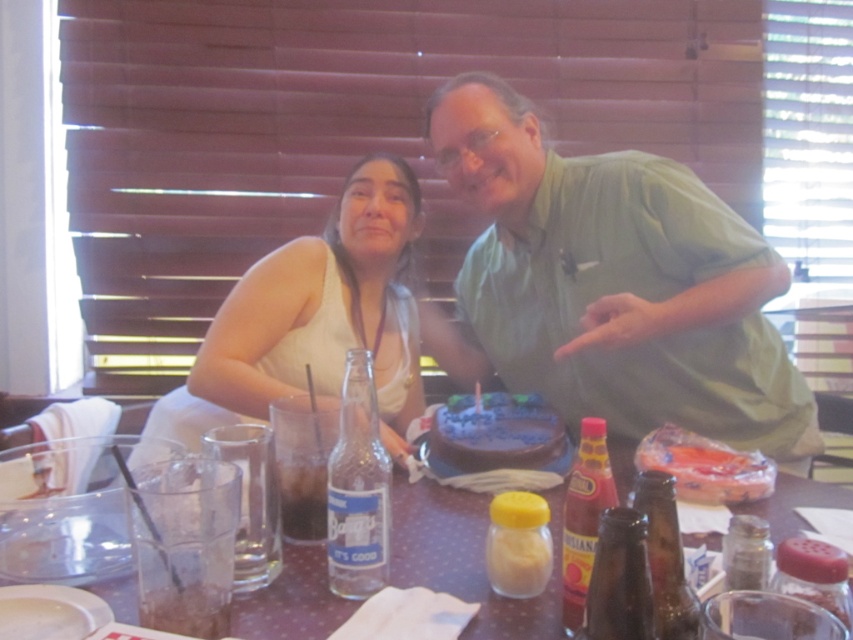
You are a server in a restaurant and need to determine if the white fabric shirt at left can be folded and placed under the brown speckled table at center without any part of it sticking out. Based on their sizes, what would you conclude?

The white fabric shirt at left is larger in size than the brown speckled table at center. Therefore, it cannot be folded and placed under the brown speckled table at center without part of it sticking out.